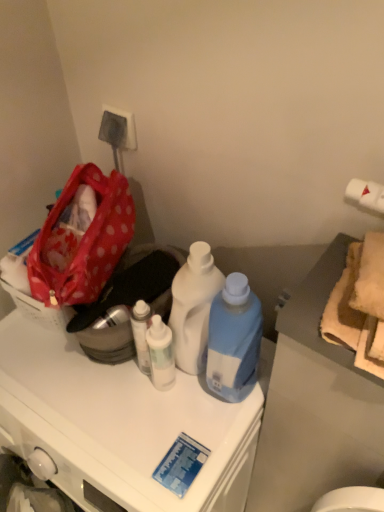
Question: From a real-world perspective, relative to red polka dot fabric bag at left, is white glossy bottle at center, which ranks as the 1th bottle in left-to-right order, vertically above or below?

Choices:
 (A) above
 (B) below

Answer: (B)

Question: In terms of height, does white glossy bottle at center, which ranks as the 1th bottle in left-to-right order, look taller or shorter compared to red polka dot fabric bag at left?

Choices:
 (A) short
 (B) tall

Answer: (A)

Question: Estimate the real-world distances between objects in this image. Which object is farther from the blue plastic bottle at center, the 1th bottle when ordered from right to left?

Choices:
 (A) red polka dot fabric bag at left
 (B) white plastic bottle at center, marked as the second bottle in a right-to-left arrangement
 (C) white glossy bottle at center, which ranks as the 1th bottle in left-to-right order
 (D) white glossy cabinet at center
 (E) polka dot fabric picnic basket at left

Answer: (E)

Question: Estimate the real-world distances between objects in this image. Which object is farther from the red polka dot fabric bag at left?

Choices:
 (A) blue plastic bottle at center, which is counted as the third bottle, starting from the left
 (B) white plastic bottle at center, acting as the second bottle starting from the left
 (C) white glossy cabinet at center
 (D) polka dot fabric picnic basket at left
 (E) white glossy bottle at center, which ranks as the 1th bottle in left-to-right order

Answer: (A)